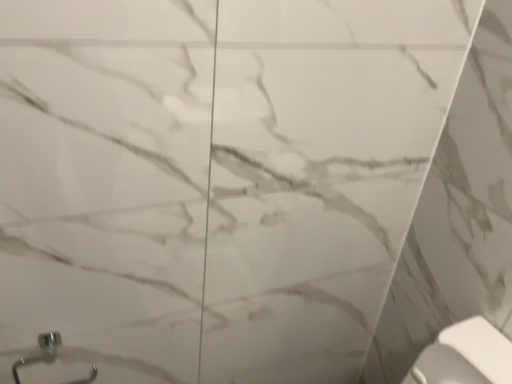
What do you see at coordinates (40, 353) in the screenshot? I see `satin chrome faucet at lower left` at bounding box center [40, 353].

What is the approximate height of satin chrome faucet at lower left?

satin chrome faucet at lower left is 5.65 inches tall.

Locate an element on the screen. satin chrome faucet at lower left is located at coordinates (40, 353).

I want to click on satin chrome faucet at lower left, so click(x=40, y=353).